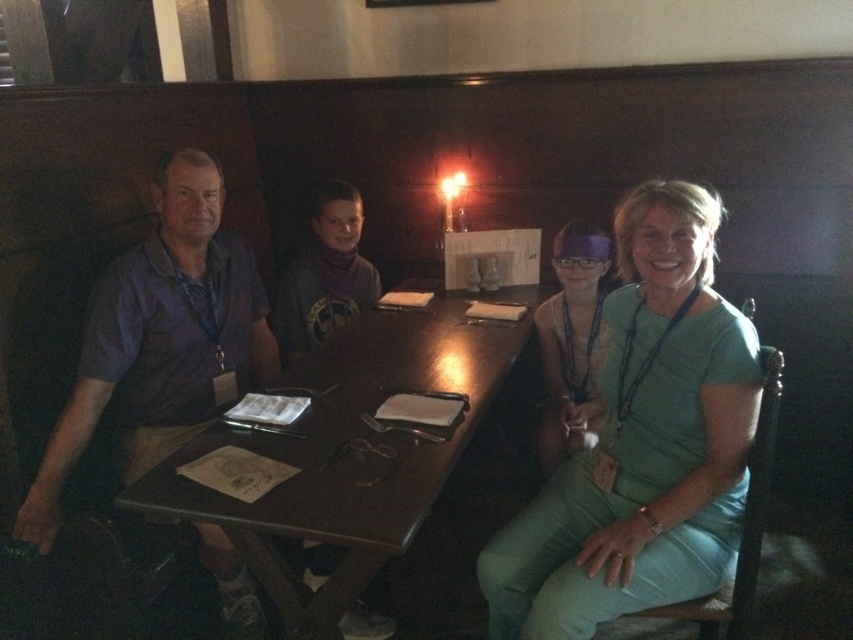
Question: Can you confirm if purple cotton shirt at left is bigger than green fabric shirt at right?

Choices:
 (A) no
 (B) yes

Answer: (B)

Question: Which is farther from the dark wood table at center?

Choices:
 (A) green fabric shirt at right
 (B) matte green dress at center
 (C) green cotton shirt at center
 (D) purple cotton shirt at left

Answer: (B)

Question: Does purple cotton shirt at left appear on the right side of green fabric shirt at right?

Choices:
 (A) yes
 (B) no

Answer: (B)

Question: Which of these objects is positioned farthest from the green cotton shirt at center?

Choices:
 (A) green fabric shirt at right
 (B) purple cotton shirt at left

Answer: (B)

Question: Does dark wood table at center have a smaller size compared to purple cotton shirt at left?

Choices:
 (A) yes
 (B) no

Answer: (B)

Question: Based on their relative distances, which object is farther from the green fabric shirt at right?

Choices:
 (A) matte green dress at center
 (B) purple cotton shirt at left
 (C) green cotton shirt at center
 (D) dark wood table at center

Answer: (B)